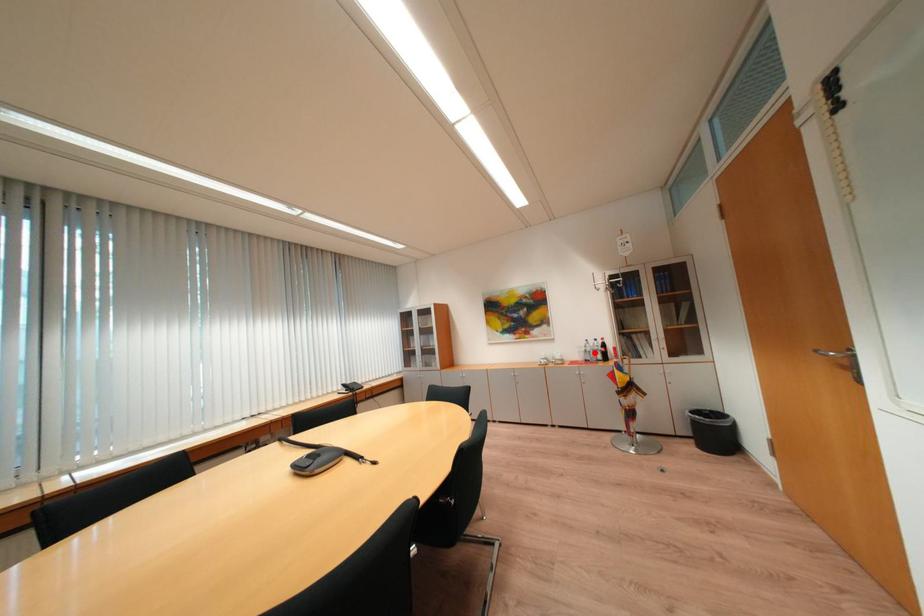
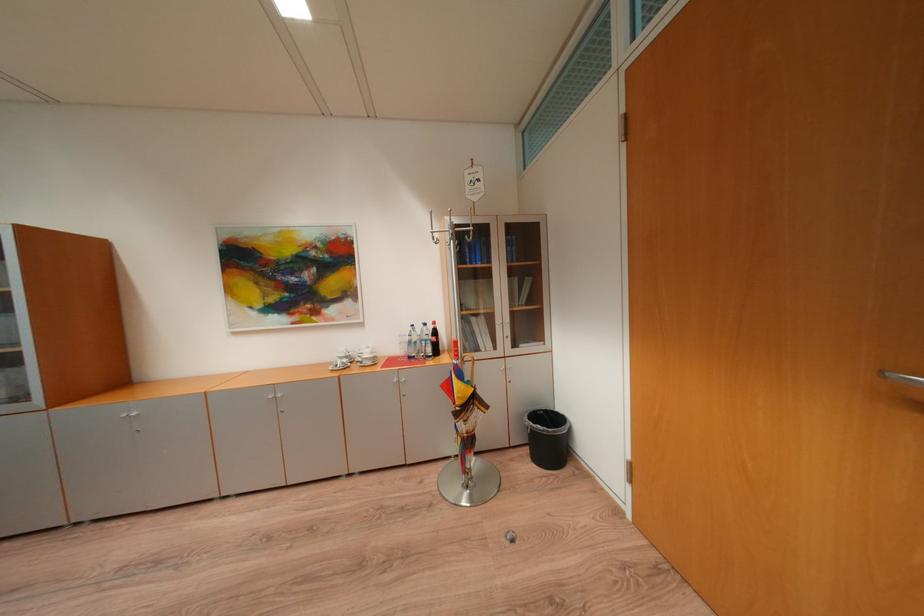
Where in the second image is the point corresponding to the highlighted location from the first image?

(419, 344)